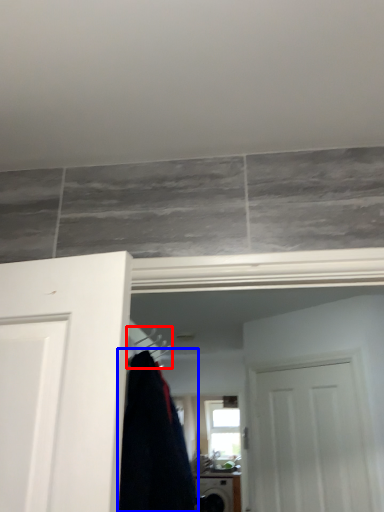
Question: Which object is further to the camera taking this photo, hanger (highlighted by a red box) or clothing (highlighted by a blue box)?

Choices:
 (A) hanger
 (B) clothing

Answer: (A)